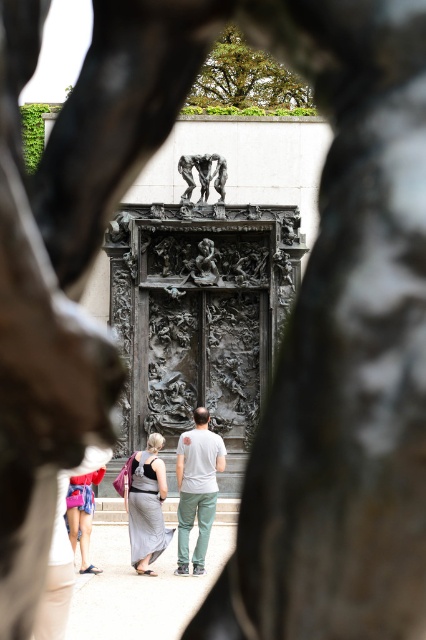
Which is more to the left, denim shorts at lower left or polished bronze sculpture at center?

denim shorts at lower left is more to the left.

From the picture: Is denim shorts at lower left further to camera compared to polished bronze sculpture at center?

That is False.

Is point (77, 538) positioned before point (187, 188)?

That is True.

The image size is (426, 640). I want to click on denim shorts at lower left, so click(81, 515).

Who is positioned more to the left, matte gray dress at center or polished bronze sculpture at center?

matte gray dress at center

Measure the distance between matte gray dress at center and polished bronze sculpture at center.

matte gray dress at center is 23.95 meters from polished bronze sculpture at center.

Which is behind, point (196, 563) or point (221, 180)?

Positioned behind is point (221, 180).

Image resolution: width=426 pixels, height=640 pixels. In order to click on matte gray dress at center in this screenshot , I will do `click(196, 488)`.

Is matte gray t-shirt at center thinner than polished bronze sculpture at center?

Correct, matte gray t-shirt at center's width is less than polished bronze sculpture at center's.

Is point (187, 552) closer to viewer compared to point (187, 196)?

That is True.

At what (x,y) coordinates should I click in order to perform the action: click on matte gray t-shirt at center. Please return your answer as a coordinate pair (x, y). This screenshot has width=426, height=640. Looking at the image, I should click on (196, 488).